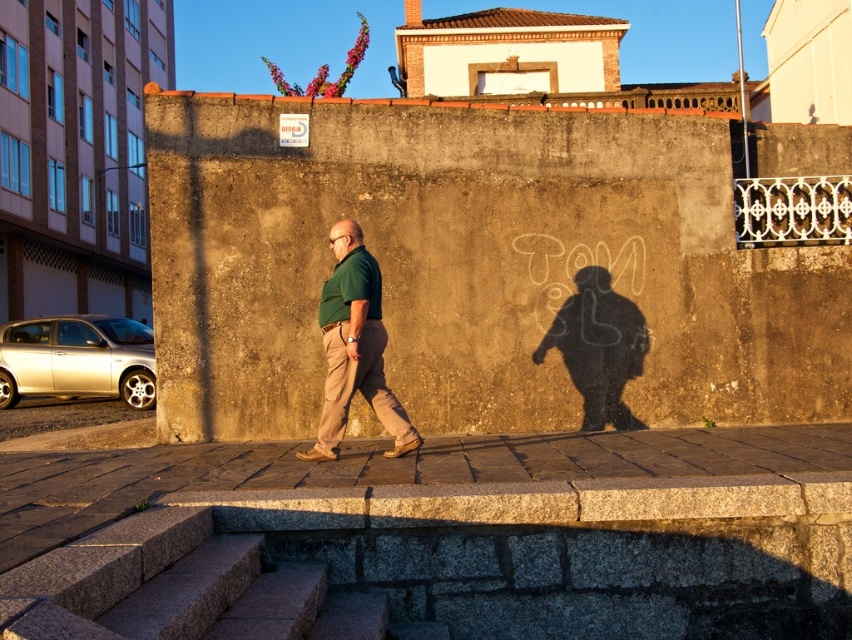
Between granite pavement at center and granite steps at lower left, which one is positioned higher?

Positioned higher is granite steps at lower left.

Is granite pavement at center to the right of granite steps at lower left from the viewer's perspective?

Incorrect, granite pavement at center is not on the right side of granite steps at lower left.

Is point (27, 460) less distant than point (159, 524)?

No, (27, 460) is behind (159, 524).

At what (x,y) coordinates should I click in order to perform the action: click on granite pavement at center. Please return your answer as a coordinate pair (x, y). Looking at the image, I should click on (377, 468).

Can you confirm if granite steps at lower left is smaller than green matte shirt at center?

No, granite steps at lower left is not smaller than green matte shirt at center.

Which is in front, point (79, 592) or point (327, 372)?

Positioned in front is point (79, 592).

Where is `granite steps at lower left`? The image size is (852, 640). granite steps at lower left is located at coordinates (177, 588).

Which is below, granite pavement at center or green matte shirt at center?

granite pavement at center

Is granite pavement at center above green matte shirt at center?

Actually, granite pavement at center is below green matte shirt at center.

Between point (22, 496) and point (344, 236), which one is positioned in front?

Positioned in front is point (22, 496).

Image resolution: width=852 pixels, height=640 pixels. What are the coordinates of `granite pavement at center` in the screenshot? It's located at (377, 468).